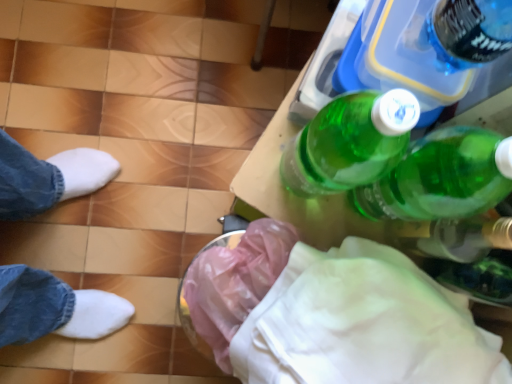
Question: Is green plastic bottle at upper right completely or partially outside of transparent plastic bottle at lower right?

Choices:
 (A) no
 (B) yes

Answer: (B)

Question: Considering the relative sizes of green plastic bottle at upper right and transparent plastic bottle at lower right in the image provided, is green plastic bottle at upper right smaller than transparent plastic bottle at lower right?

Choices:
 (A) yes
 (B) no

Answer: (B)

Question: Is green plastic bottle at upper right at the right side of transparent plastic bottle at lower right?

Choices:
 (A) no
 (B) yes

Answer: (A)

Question: From the image's perspective, is green plastic bottle at upper right beneath transparent plastic bottle at lower right?

Choices:
 (A) yes
 (B) no

Answer: (B)

Question: Is green plastic bottle at upper right bigger than transparent plastic bottle at lower right?

Choices:
 (A) no
 (B) yes

Answer: (B)

Question: Is point (428, 307) positioned closer to the camera than point (266, 240)?

Choices:
 (A) farther
 (B) closer

Answer: (B)

Question: From the image's perspective, relative to pink plastic bag at lower center, is white fabric at lower right above or below?

Choices:
 (A) above
 (B) below

Answer: (B)

Question: Considering the positions of white fabric at lower right and pink plastic bag at lower center in the image, is white fabric at lower right taller or shorter than pink plastic bag at lower center?

Choices:
 (A) short
 (B) tall

Answer: (B)

Question: Is white fabric at lower right inside or outside of pink plastic bag at lower center?

Choices:
 (A) inside
 (B) outside

Answer: (B)

Question: Looking at the image, does pink plastic bag at lower center seem bigger or smaller compared to green plastic bottle at upper right?

Choices:
 (A) small
 (B) big

Answer: (A)

Question: In terms of height, does pink plastic bag at lower center look taller or shorter compared to green plastic bottle at upper right?

Choices:
 (A) tall
 (B) short

Answer: (A)

Question: Does point (195, 264) appear closer or farther from the camera than point (480, 61)?

Choices:
 (A) farther
 (B) closer

Answer: (A)

Question: From the image's perspective, is pink plastic bag at lower center above or below green plastic bottle at upper right?

Choices:
 (A) above
 (B) below

Answer: (B)

Question: Is green plastic bottle at upper right in front of or behind pink plastic bag at lower center in the image?

Choices:
 (A) behind
 (B) front

Answer: (B)

Question: From their relative heights in the image, would you say green plastic bottle at upper right is taller or shorter than pink plastic bag at lower center?

Choices:
 (A) short
 (B) tall

Answer: (A)